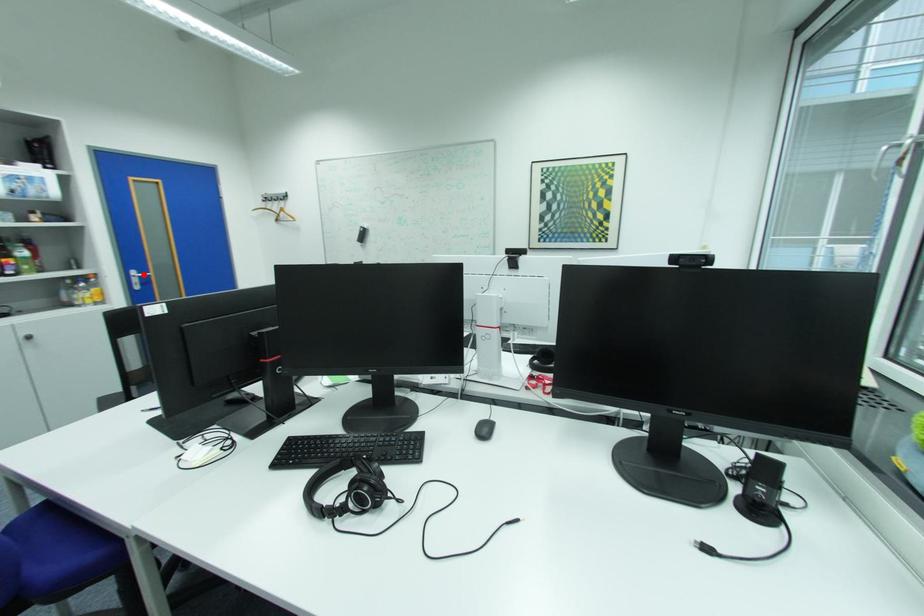
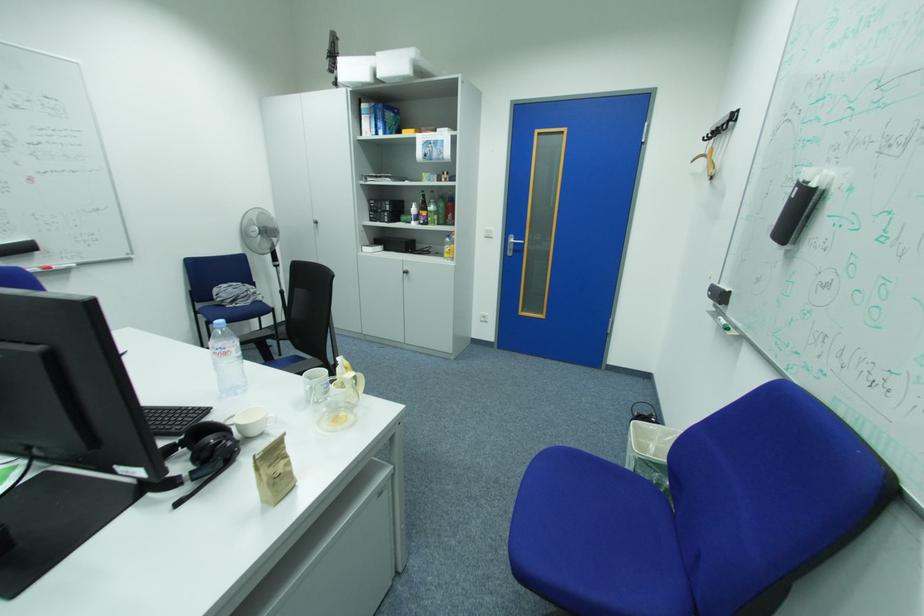
In the second image, find the point that corresponds to the highlighted location in the first image.

(520, 240)